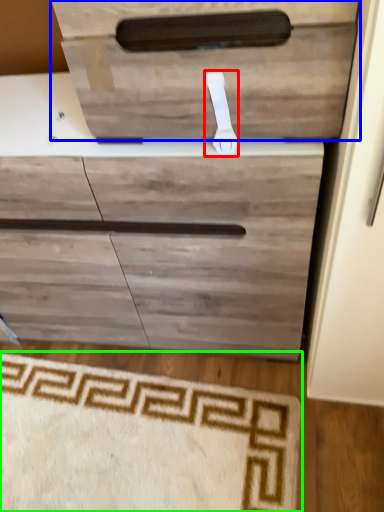
Question: Estimate the real-world distances between objects in this image. Which object is farther from door handle (highlighted by a red box), drawer (highlighted by a blue box) or doormat (highlighted by a green box)?

Choices:
 (A) drawer
 (B) doormat

Answer: (B)